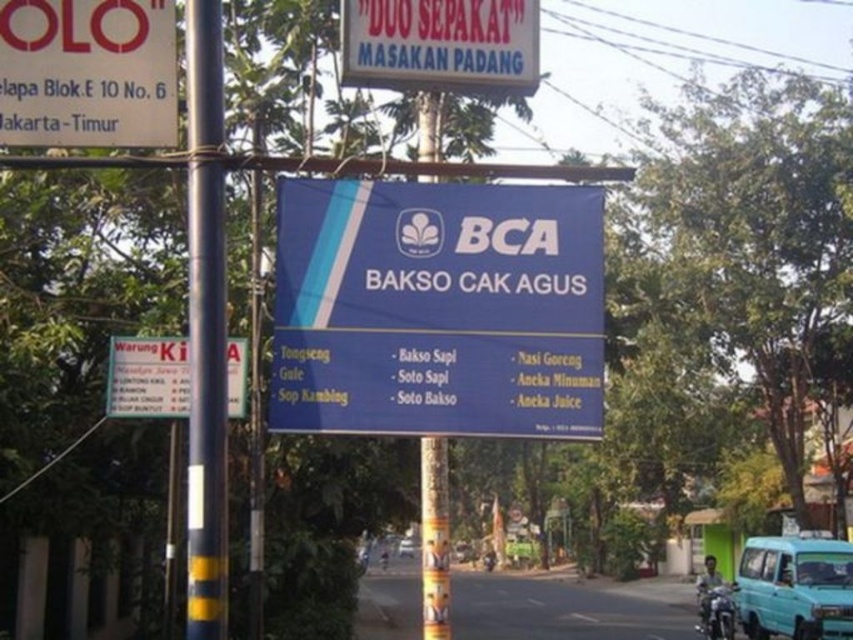
Question: Does blue plastic signboard at center have a larger size compared to white paper sign at left?

Choices:
 (A) no
 (B) yes

Answer: (B)

Question: Which object is positioned closest to the blue metallic van at center?

Choices:
 (A) white paper sign at left
 (B) white plastic sign at upper left

Answer: (A)

Question: Which is nearer to the blue painted metal pole at left?

Choices:
 (A) blue metallic van at center
 (B) white paper sign at left

Answer: (B)

Question: Can you confirm if blue painted metal pole at left is positioned below white paper sign at left?

Choices:
 (A) no
 (B) yes

Answer: (A)

Question: Is blue plastic signboard at center closer to the viewer compared to white plastic signboard at upper center?

Choices:
 (A) yes
 (B) no

Answer: (A)

Question: Which point appears farthest from the camera in this image?

Choices:
 (A) (218, 228)
 (B) (488, 20)

Answer: (B)